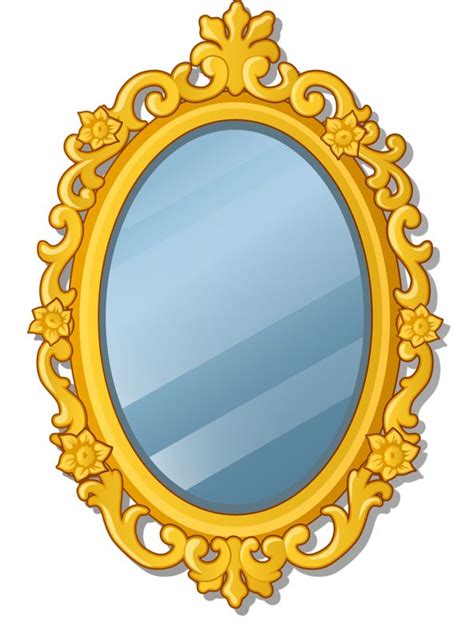
Find the location of `left middle flower`. left middle flower is located at coordinates (58, 321).